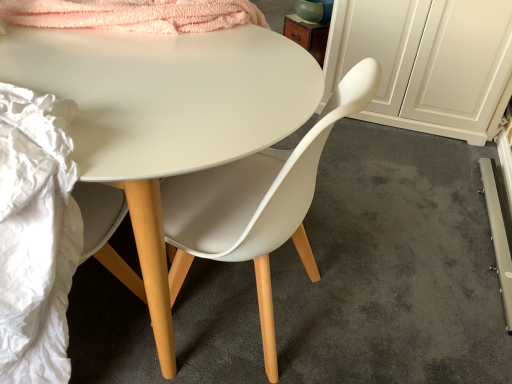
Where is `vacant region above white matte desk at center (from a real-world perspective)`? The height and width of the screenshot is (384, 512). vacant region above white matte desk at center (from a real-world perspective) is located at coordinates (141, 69).